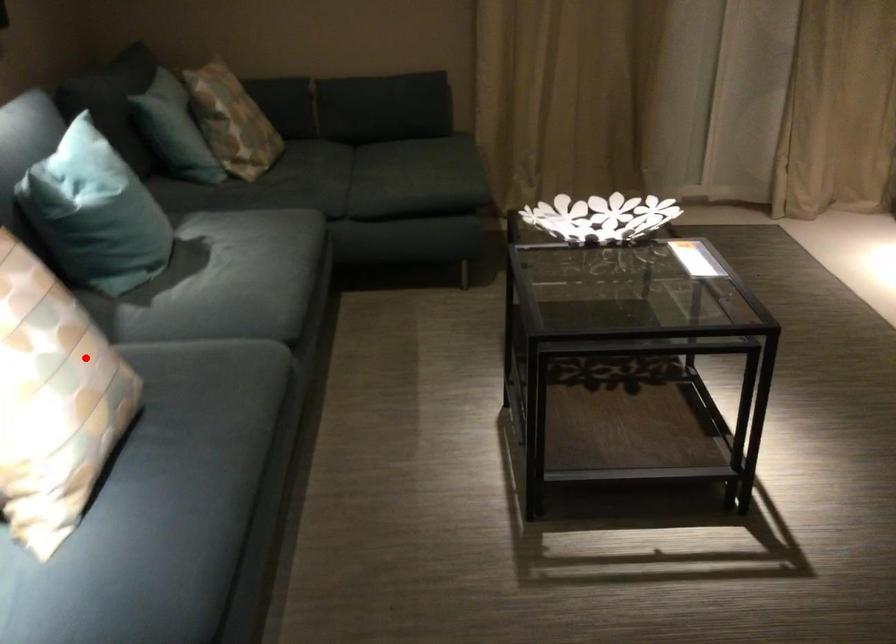
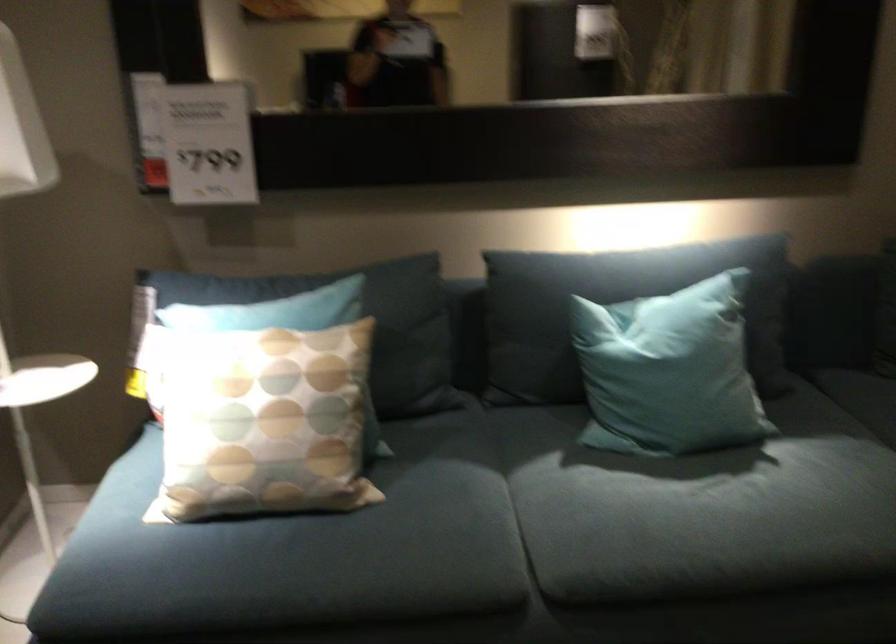
Where in the second image is the point corresponding to the highlighted location from the first image?

(263, 422)